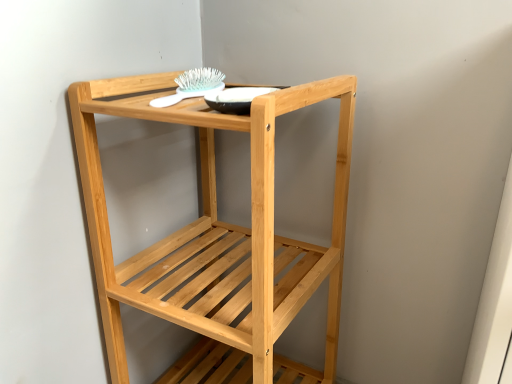
Where is `natural wood shelf at center`? This screenshot has width=512, height=384. natural wood shelf at center is located at coordinates (216, 241).

From the picture: Who is taller, natural wood shelf at center or matte black bowl at upper center?

natural wood shelf at center is taller.

From a real-world perspective, is natural wood shelf at center beneath matte black bowl at upper center?

Yes.

Locate an element on the screen. This screenshot has width=512, height=384. furniture below the matte black bowl at upper center (from the image's perspective) is located at coordinates (216, 241).

Which of these two, natural wood shelf at center or matte black bowl at upper center, is bigger?

natural wood shelf at center is bigger.

Considering the sizes of objects white plastic brush at upper center and natural wood shelf at center in the image provided, who is taller, white plastic brush at upper center or natural wood shelf at center?

Standing taller between the two is natural wood shelf at center.

Could you tell me if white plastic brush at upper center is turned towards natural wood shelf at center?

Yes.

Would you consider white plastic brush at upper center to be distant from natural wood shelf at center?

white plastic brush at upper center is actually quite close to natural wood shelf at center.

How far apart are white plastic brush at upper center and natural wood shelf at center?

They are 11.80 inches apart.

In the scene shown: Is matte black bowl at upper center next to white plastic brush at upper center and touching it?

Yes, matte black bowl at upper center is in contact with white plastic brush at upper center.

Could you tell me if matte black bowl at upper center is turned towards white plastic brush at upper center?

No, matte black bowl at upper center is not oriented towards white plastic brush at upper center.

Looking at this image, considering their positions, is matte black bowl at upper center located in front of or behind white plastic brush at upper center?

Visually, matte black bowl at upper center is located in front of white plastic brush at upper center.

Is matte black bowl at upper center not within natural wood shelf at center?

No, matte black bowl at upper center is not outside of natural wood shelf at center.

Considering the positions of objects matte black bowl at upper center and natural wood shelf at center in the image provided, who is behind, matte black bowl at upper center or natural wood shelf at center?

matte black bowl at upper center is more distant.

Which is more to the left, matte black bowl at upper center or natural wood shelf at center?

natural wood shelf at center.

Considering the positions of points (275, 88) and (70, 89), is point (275, 88) closer to camera compared to point (70, 89)?

No.

From a real-world perspective, is white plastic brush at upper center beneath matte black bowl at upper center?

Correct, in the physical world, white plastic brush at upper center is lower than matte black bowl at upper center.

Does point (198, 70) appear closer or farther from the camera than point (223, 104)?

Point (198, 70).

Could you tell me if white plastic brush at upper center is facing matte black bowl at upper center?

No, white plastic brush at upper center is not oriented towards matte black bowl at upper center.

Relative to matte black bowl at upper center, is white plastic brush at upper center in front or behind?

Visually, white plastic brush at upper center is located behind matte black bowl at upper center.

From the image's perspective, relative to white plastic brush at upper center, is natural wood shelf at center above or below?

Based on their image positions, natural wood shelf at center is located beneath white plastic brush at upper center.

Is natural wood shelf at center aimed at white plastic brush at upper center?

No, natural wood shelf at center does not turn towards white plastic brush at upper center.

Is natural wood shelf at center far away from white plastic brush at upper center?

Actually, natural wood shelf at center and white plastic brush at upper center are a little close together.

Does point (297, 281) come behind point (202, 76)?

Yes, it is.

Image resolution: width=512 pixels, height=384 pixels. I want to click on glass bowl above the natural wood shelf at center (from the image's perspective), so click(x=236, y=99).

This screenshot has height=384, width=512. What are the coordinates of `furniture on the right side of white plastic brush at upper center` in the screenshot? It's located at (216, 241).

Looking at the image, which one is located closer to natural wood shelf at center, matte black bowl at upper center or white plastic brush at upper center?

Based on the image, matte black bowl at upper center appears to be nearer to natural wood shelf at center.

Which object lies nearer to the anchor point white plastic brush at upper center, matte black bowl at upper center or natural wood shelf at center?

matte black bowl at upper center is closer to white plastic brush at upper center.

Looking at the image, which one is located closer to white plastic brush at upper center, natural wood shelf at center or matte black bowl at upper center?

The object closer to white plastic brush at upper center is matte black bowl at upper center.

Based on their spatial positions, is white plastic brush at upper center or matte black bowl at upper center closer to natural wood shelf at center?

matte black bowl at upper center is positioned closer to the anchor natural wood shelf at center.

Looking at the image, which one is located closer to matte black bowl at upper center, natural wood shelf at center or white plastic brush at upper center?

Among the two, white plastic brush at upper center is located nearer to matte black bowl at upper center.

From the picture: Which object lies further to the anchor point matte black bowl at upper center, white plastic brush at upper center or natural wood shelf at center?

Among the two, natural wood shelf at center is located further to matte black bowl at upper center.

Find the location of `glass bowl between white plastic brush at upper center and natural wood shelf at center in the vertical direction`. glass bowl between white plastic brush at upper center and natural wood shelf at center in the vertical direction is located at coordinates (236, 99).